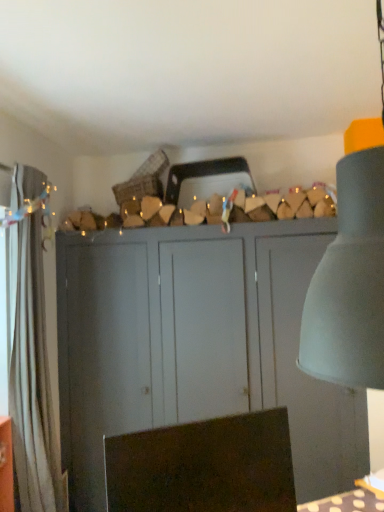
Question: Is brown fabric swivel chair at lower center smaller than white fabric curtain at left?

Choices:
 (A) no
 (B) yes

Answer: (B)

Question: Is brown fabric swivel chair at lower center at the left side of white fabric curtain at left?

Choices:
 (A) yes
 (B) no

Answer: (B)

Question: Is brown fabric swivel chair at lower center closer to the viewer compared to white fabric curtain at left?

Choices:
 (A) no
 (B) yes

Answer: (B)

Question: Does brown fabric swivel chair at lower center have a greater height compared to white fabric curtain at left?

Choices:
 (A) yes
 (B) no

Answer: (B)

Question: Is brown fabric swivel chair at lower center wider than white fabric curtain at left?

Choices:
 (A) yes
 (B) no

Answer: (B)

Question: From the image's perspective, is brown fabric swivel chair at lower center above or below white fabric curtain at left?

Choices:
 (A) above
 (B) below

Answer: (B)

Question: Is brown fabric swivel chair at lower center to the left or to the right of white fabric curtain at left in the image?

Choices:
 (A) right
 (B) left

Answer: (A)

Question: Is brown fabric swivel chair at lower center wider or thinner than white fabric curtain at left?

Choices:
 (A) wide
 (B) thin

Answer: (B)

Question: From a real-world perspective, is brown fabric swivel chair at lower center above or below white fabric curtain at left?

Choices:
 (A) below
 (B) above

Answer: (A)

Question: Looking at their shapes, would you say matte gray cupboard at center is wider or thinner than white fabric curtain at left?

Choices:
 (A) thin
 (B) wide

Answer: (B)

Question: From the image's perspective, relative to white fabric curtain at left, is matte gray cupboard at center above or below?

Choices:
 (A) below
 (B) above

Answer: (A)

Question: From a real-world perspective, is matte gray cupboard at center positioned above or below white fabric curtain at left?

Choices:
 (A) above
 (B) below

Answer: (B)

Question: Is matte gray cupboard at center inside or outside of white fabric curtain at left?

Choices:
 (A) inside
 (B) outside

Answer: (B)

Question: Is brown fabric swivel chair at lower center in front of or behind matte gray cupboard at center in the image?

Choices:
 (A) front
 (B) behind

Answer: (A)

Question: Does point (258, 480) appear closer or farther from the camera than point (178, 276)?

Choices:
 (A) farther
 (B) closer

Answer: (B)